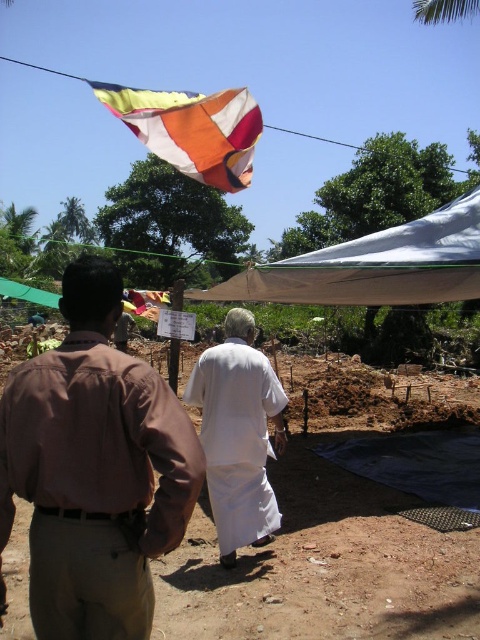
Question: Which point is closer to the camera taking this photo?

Choices:
 (A) (279, 259)
 (B) (90, 442)
 (C) (319, 515)

Answer: (B)

Question: Can you confirm if brown cotton shirt at center is positioned above white cotton robe at center?

Choices:
 (A) no
 (B) yes

Answer: (B)

Question: Which of the following is the farthest from the observer?

Choices:
 (A) tan canvas tent at center
 (B) white cotton robe at center
 (C) brown cotton shirt at center

Answer: (A)

Question: Is brown cotton shirt at center above brown soil at center?

Choices:
 (A) yes
 (B) no

Answer: (A)

Question: Which object appears closest to the camera in this image?

Choices:
 (A) white cotton robe at center
 (B) tan canvas tent at center
 (C) multi-colored fabric flag at upper center

Answer: (A)

Question: Can you confirm if brown cotton shirt at center is positioned to the left of brown soil at center?

Choices:
 (A) yes
 (B) no

Answer: (A)